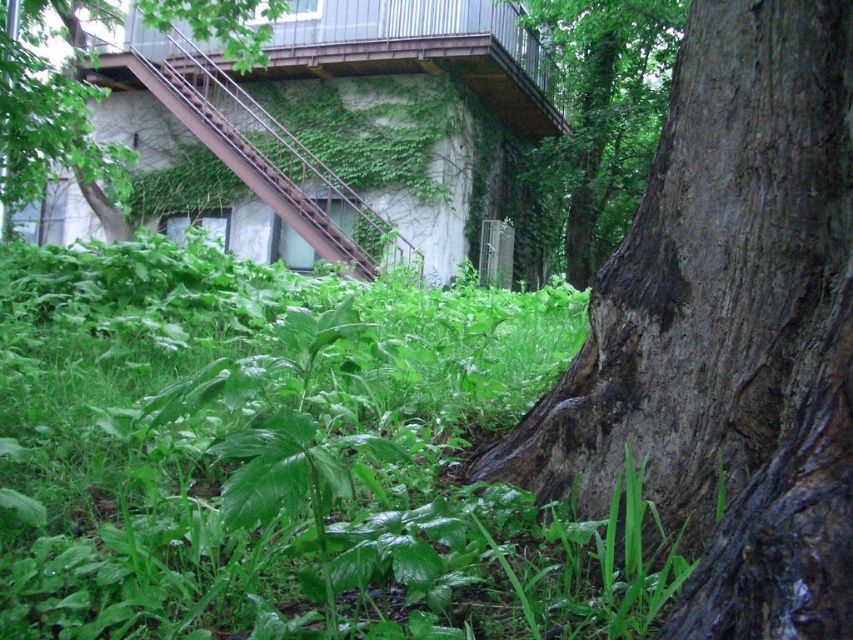
Which is behind, point (35, 99) or point (343, 228)?

The point (343, 228) is behind.

Find the location of a particular element. green leafy tree at upper left is located at coordinates click(x=54, y=113).

Can you confirm if brown rough bark tree at right is shorter than dark brown bark tree at center?

Correct, brown rough bark tree at right is not as tall as dark brown bark tree at center.

Which is in front, point (766, 454) or point (611, 147)?

Point (766, 454)

Where is `brown rough bark tree at right`? brown rough bark tree at right is located at coordinates [728, 330].

Which is more to the right, green leafy grass at center or dark brown bark tree at center?

Positioned to the right is dark brown bark tree at center.

Does green leafy grass at center have a smaller size compared to dark brown bark tree at center?

Yes.

Where is `green leafy grass at center`? The height and width of the screenshot is (640, 853). green leafy grass at center is located at coordinates (283, 458).

This screenshot has height=640, width=853. I want to click on green leafy grass at center, so click(x=283, y=458).